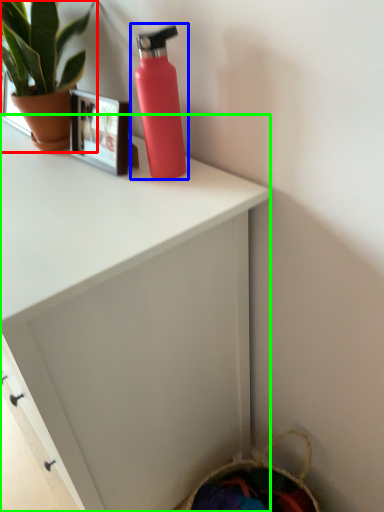
Question: Considering the real-world distances, which object is closest to houseplant (highlighted by a red box)? bottle (highlighted by a blue box) or desk (highlighted by a green box).

Choices:
 (A) bottle
 (B) desk

Answer: (A)